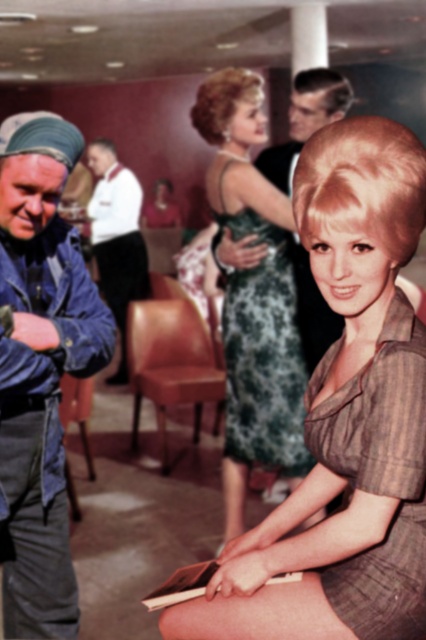
Can you confirm if blue denim jacket at left is bigger than leather at center?

Yes, blue denim jacket at left is bigger than leather at center.

Which is in front, point (37, 176) or point (158, 428)?

Positioned in front is point (37, 176).

At what (x,y) coordinates should I click in order to perform the action: click on blue denim jacket at left. Please return your answer as a coordinate pair (x, y). The image size is (426, 640). Looking at the image, I should click on click(x=40, y=371).

Does smooth black suit at center have a lesser width compared to white satin shirt at upper center?

In fact, smooth black suit at center might be wider than white satin shirt at upper center.

Does smooth black suit at center lie in front of white satin shirt at upper center?

Yes, it is in front of white satin shirt at upper center.

Is point (313, 365) more distant than point (121, 176)?

Yes.

This screenshot has width=426, height=640. Identify the location of smooth black suit at center. (305, 120).

From the picture: Who is positioned more to the right, shiny brown dress at center or leather at center?

Positioned to the right is shiny brown dress at center.

I want to click on shiny brown dress at center, so click(x=345, y=417).

Is point (310, 422) positioned behind point (199, 378)?

No, (310, 422) is closer to viewer.

This screenshot has width=426, height=640. I want to click on shiny brown dress at center, so click(345, 417).